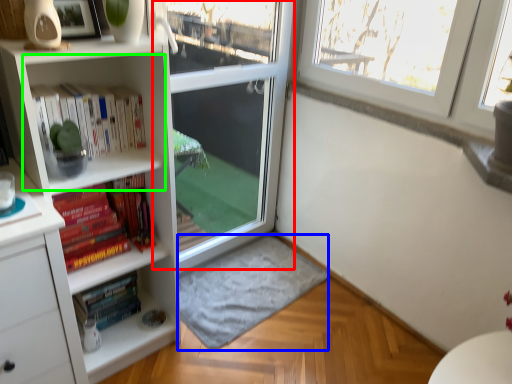
Question: Based on their relative distances, which object is farther from screen door (highlighted by a red box)? Choose from wide (highlighted by a blue box) and cabinet (highlighted by a green box).

Choices:
 (A) wide
 (B) cabinet

Answer: (B)